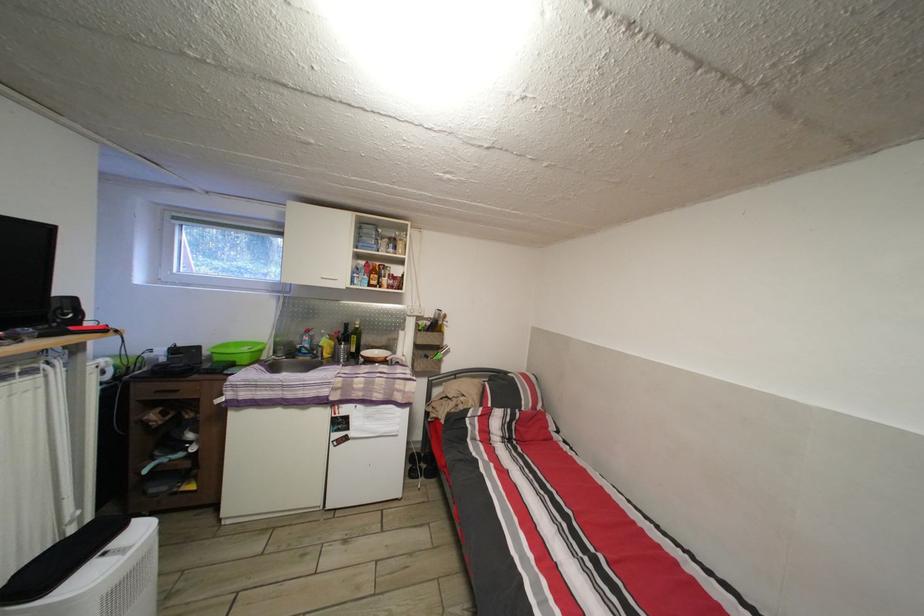
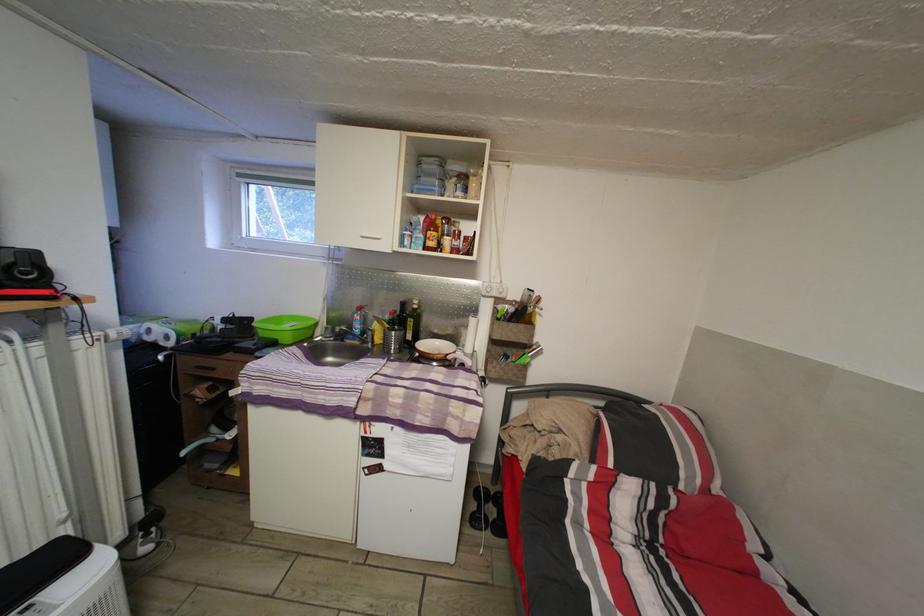
Locate, in the second image, the point that corresponds to [360,345] in the first image.

(418, 329)